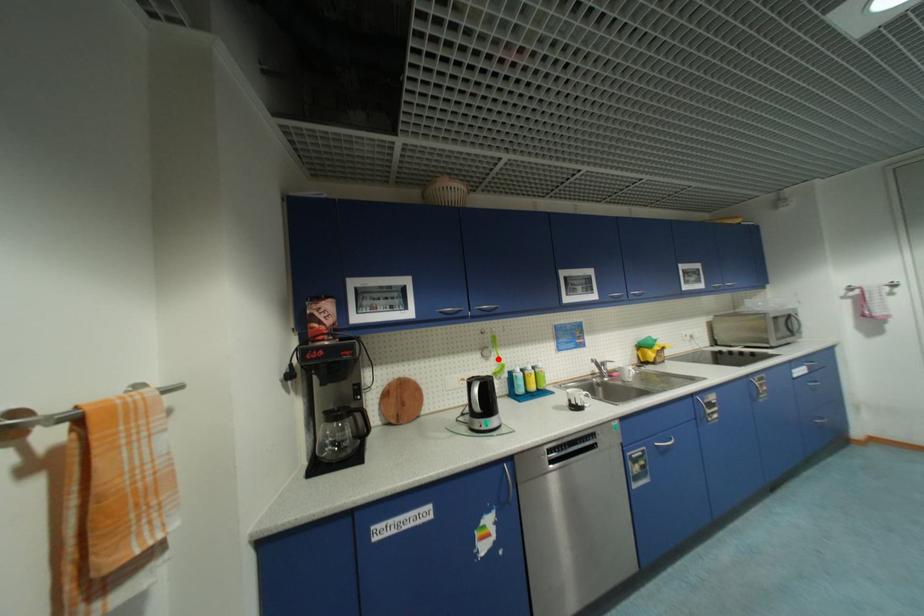
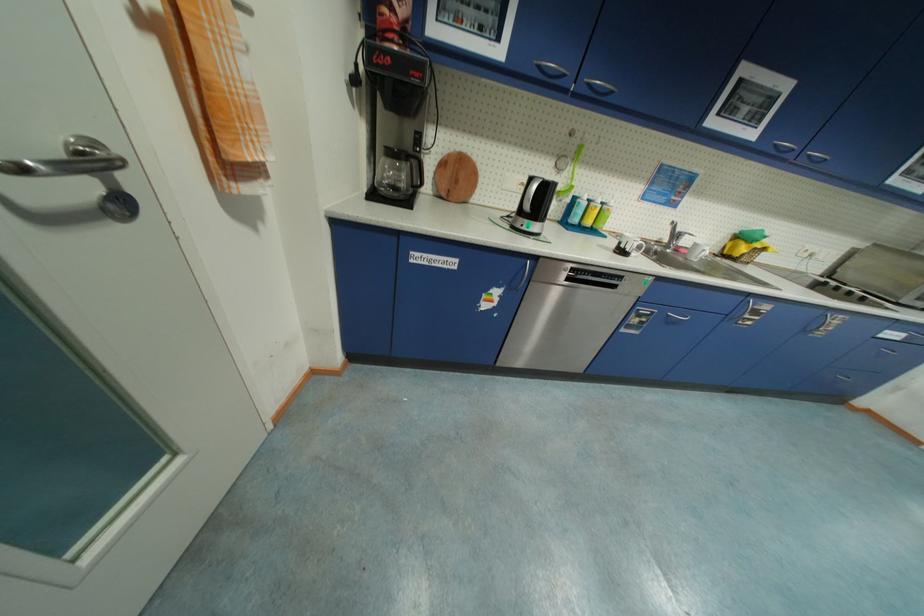
Find the pixel in the second image that matches the highlighted location in the first image.

(570, 175)